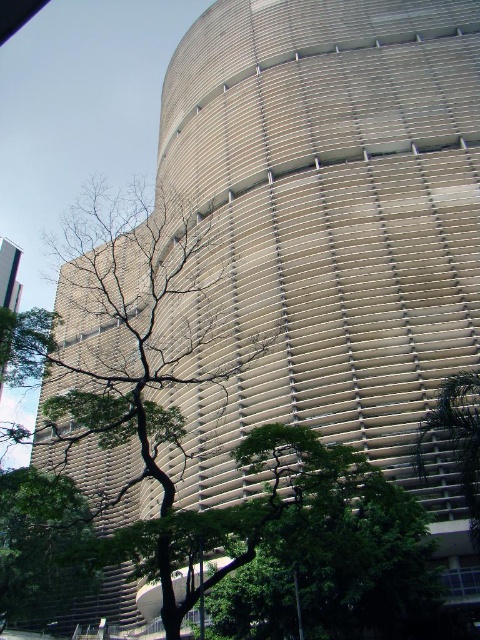
You are an urban planner assessing the space between the green leafy tree at center and the green leafy tree at lower right. Based on their widths, which tree would cast a wider shadow during midday?

The green leafy tree at center has a larger width than the green leafy tree at lower right, so it would cast a wider shadow during midday.

In the scene shown: You are standing at the entrance of the modern architectural structure and want to plant a new tree in the exact center of the building. The green leafy tree at center is currently at point 0.547, 0.283. Is the existing tree already positioned where you want to plant the new one?

The green leafy tree at center is located at point (135,349), so if the desired center point matches these coordinates, then yes, the existing tree is already there. Otherwise, you would need to adjust the planting location accordingly.

You are an urban planner assessing the view of the modern building. You notice the green leafy tree at center and the green leafy tree at lower right. Which tree might block the view of the building more significantly?

The green leafy tree at center is much taller than the green leafy tree at lower right, so it might block the view of the building more significantly.